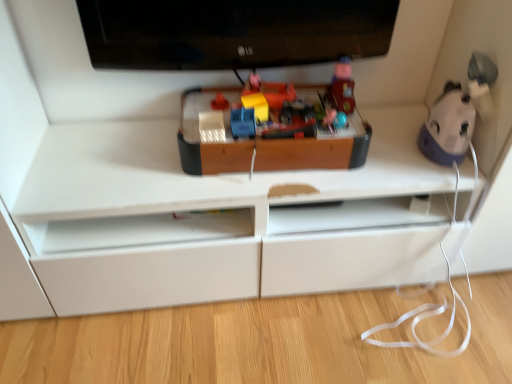
Question: Is black glossy television at upper center surrounding matte plastic toy at upper center, the 5th toy viewed from the left?

Choices:
 (A) no
 (B) yes

Answer: (A)

Question: Is the depth of black glossy television at upper center greater than that of matte plastic toy at upper center, which appears as the 2th toy when viewed from the right?

Choices:
 (A) yes
 (B) no

Answer: (B)

Question: From the image's perspective, is black glossy television at upper center over matte plastic toy at upper center, which appears as the 2th toy when viewed from the right?

Choices:
 (A) no
 (B) yes

Answer: (B)

Question: Considering the relative sizes of black glossy television at upper center and matte plastic toy at upper center, which appears as the 2th toy when viewed from the right, in the image provided, is black glossy television at upper center taller than matte plastic toy at upper center, which appears as the 2th toy when viewed from the right,?

Choices:
 (A) no
 (B) yes

Answer: (B)

Question: Can you confirm if black glossy television at upper center is shorter than matte plastic toy at upper center, the 5th toy viewed from the left?

Choices:
 (A) yes
 (B) no

Answer: (B)

Question: Is wooden toy at center, placed as the fourth toy when sorted from left to right, inside the boundaries of matte blue plastic toy car at center, arranged as the 2th toy when viewed from the left, or outside?

Choices:
 (A) inside
 (B) outside

Answer: (B)

Question: From the image's perspective, is wooden toy at center, placed as the fourth toy when sorted from left to right, above or below matte blue plastic toy car at center, arranged as the 2th toy when viewed from the left?

Choices:
 (A) below
 (B) above

Answer: (B)

Question: Looking at the image, does wooden toy at center, the 3th toy positioned from the right, seem bigger or smaller compared to matte blue plastic toy car at center, the fifth toy from the right?

Choices:
 (A) small
 (B) big

Answer: (B)

Question: Is point (340, 66) closer or farther from the camera than point (239, 110)?

Choices:
 (A) closer
 (B) farther

Answer: (B)

Question: Considering the relative positions of wooden toy at center, the 3th toy positioned from the right, and matte plastic toy at upper center, the 5th toy viewed from the left, in the image provided, is wooden toy at center, the 3th toy positioned from the right, to the left or to the right of matte plastic toy at upper center, the 5th toy viewed from the left,?

Choices:
 (A) left
 (B) right

Answer: (A)

Question: From their relative heights in the image, would you say wooden toy at center, placed as the fourth toy when sorted from left to right, is taller or shorter than matte plastic toy at upper center, the 5th toy viewed from the left?

Choices:
 (A) short
 (B) tall

Answer: (A)

Question: Looking at their shapes, would you say wooden toy at center, the 3th toy positioned from the right, is wider or thinner than matte plastic toy at upper center, the 5th toy viewed from the left?

Choices:
 (A) wide
 (B) thin

Answer: (A)

Question: In the image, is wooden toy at center, placed as the fourth toy when sorted from left to right, positioned in front of or behind matte plastic toy at upper center, the 5th toy viewed from the left?

Choices:
 (A) front
 (B) behind

Answer: (A)

Question: From their relative heights in the image, would you say wooden toy at center, placed as the fourth toy when sorted from left to right, is taller or shorter than matte plastic toy at center, which ranks as the sixth toy in right-to-left order?

Choices:
 (A) tall
 (B) short

Answer: (A)

Question: Visually, is wooden toy at center, placed as the fourth toy when sorted from left to right, positioned to the left or to the right of matte plastic toy at center, which appears as the first toy when viewed from the left?

Choices:
 (A) right
 (B) left

Answer: (A)